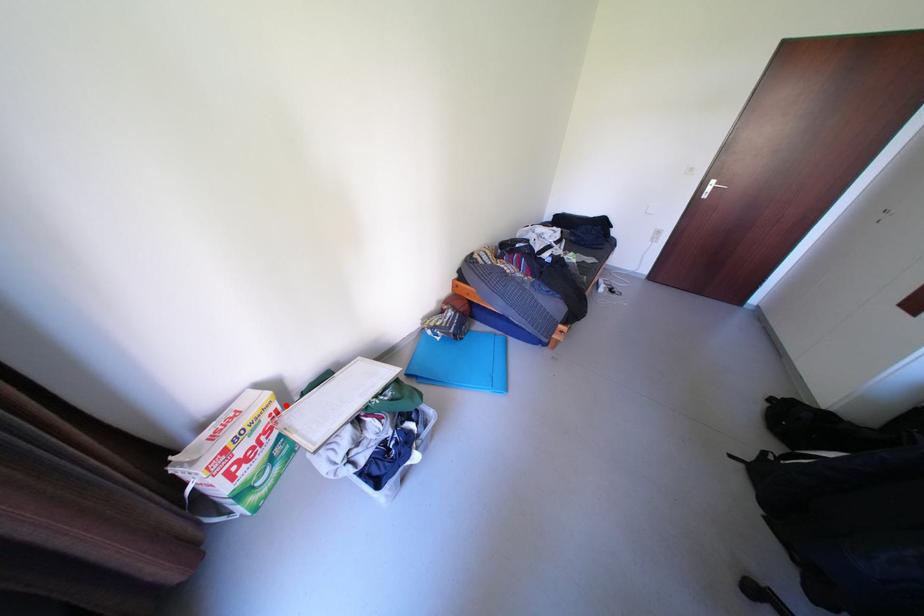
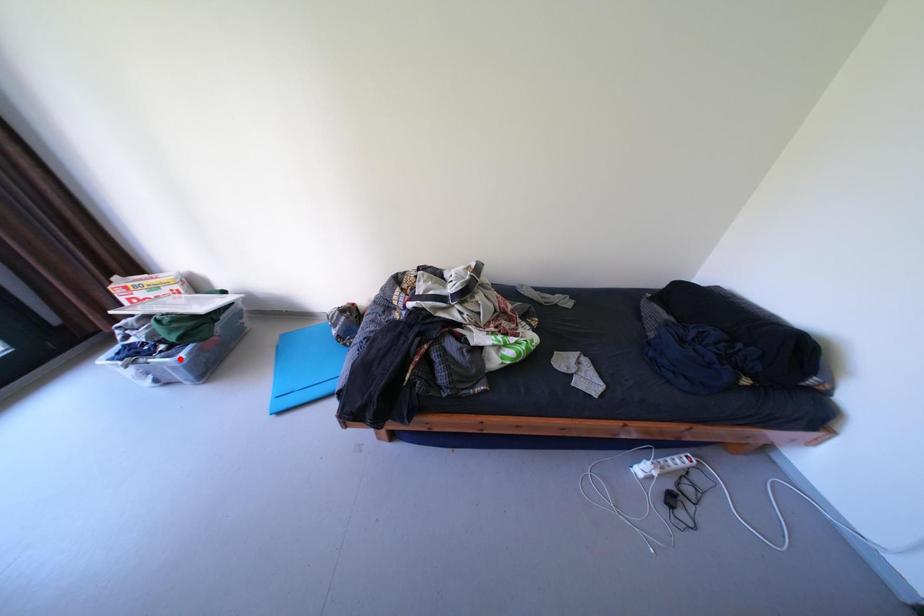
I am providing you with two images of the same scene from different viewpoints. A red point is marked on the first image and another point is marked on the second image. Is the red point in image1 aligned with the point shown in image2?

No